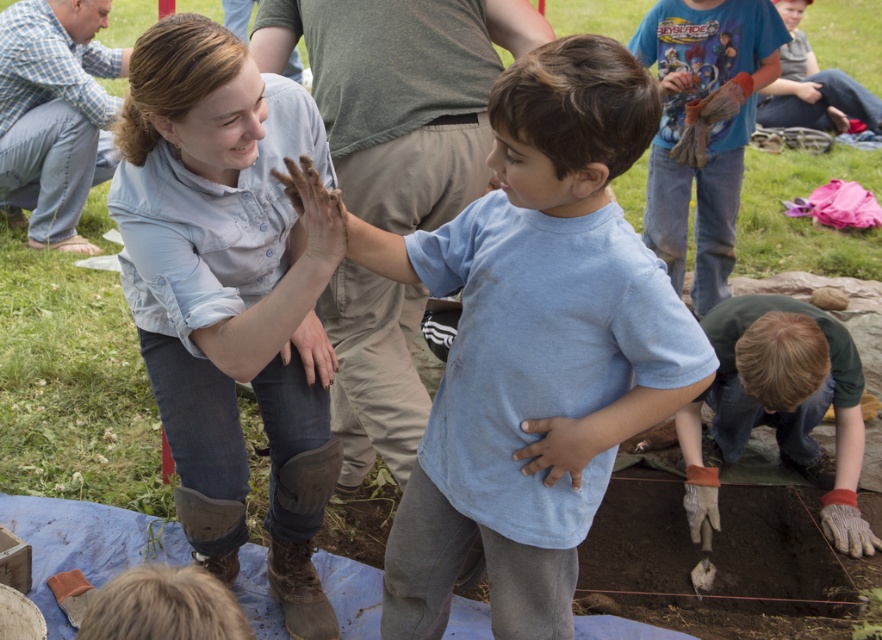
Question: Does light blue cotton shirt at center appear on the left side of blue cotton shirt at upper right?

Choices:
 (A) yes
 (B) no

Answer: (A)

Question: Among these objects, which one is nearest to the camera?

Choices:
 (A) blue cotton shirt at upper center
 (B) blue plaid shirt at upper left
 (C) green cotton shirt at lower right

Answer: (C)

Question: Can you confirm if green cotton shirt at lower right is wider than blue plaid shirt at upper left?

Choices:
 (A) no
 (B) yes

Answer: (A)

Question: Can you confirm if light blue cotton shirt at center is positioned above denim jeans at center?

Choices:
 (A) yes
 (B) no

Answer: (B)

Question: Considering the real-world distances, which object is farthest from the blue plaid shirt at upper left?

Choices:
 (A) blue cotton shirt at upper right
 (B) denim jeans at center

Answer: (A)

Question: Which object is positioned closest to the blue cotton shirt at center?

Choices:
 (A) green cotton shirt at lower right
 (B) blue plaid shirt at upper left
 (C) denim jeans at center

Answer: (C)